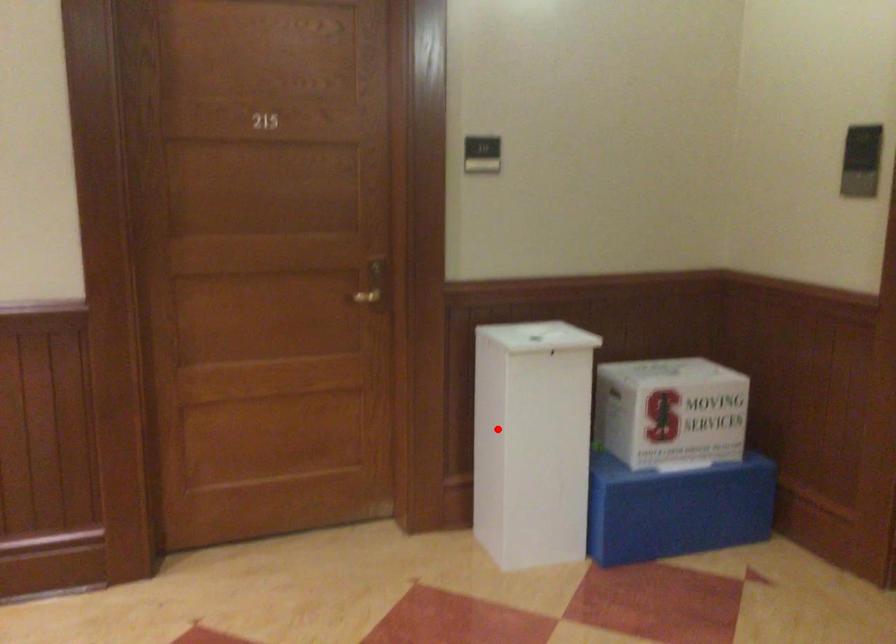
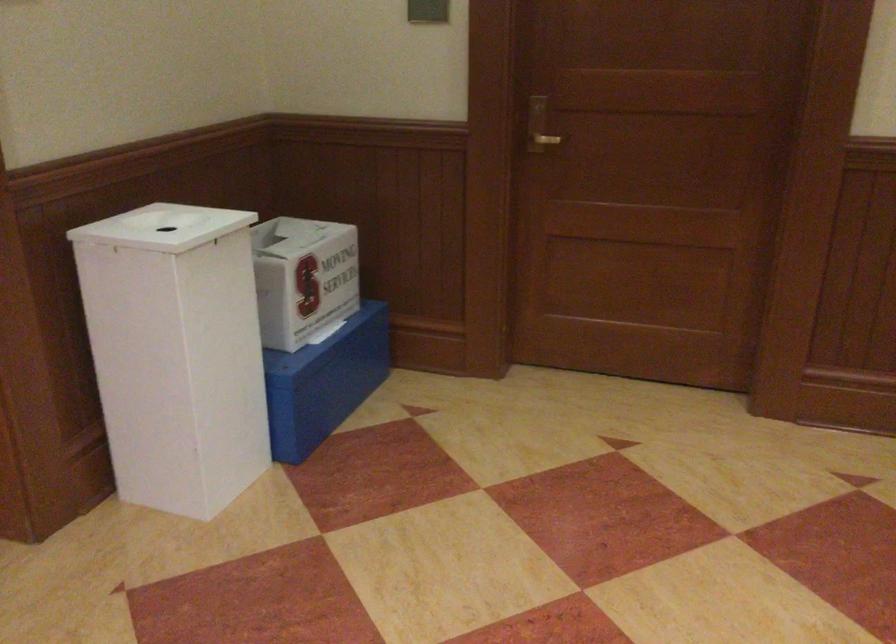
Find the pixel in the second image that matches the highlighted location in the first image.

(176, 353)